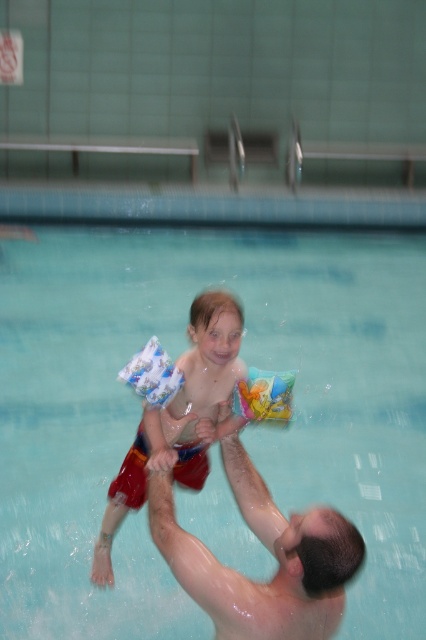
Question: Is shiny wet skin at center below white printed armbands at center?

Choices:
 (A) yes
 (B) no

Answer: (B)

Question: Is shiny wet skin at center to the right of multicolored plastic toy at upper center from the viewer's perspective?

Choices:
 (A) yes
 (B) no

Answer: (B)

Question: Which point is farther to the camera?

Choices:
 (A) white printed armbands at center
 (B) white printed floaties at center
 (C) shiny wet skin at center

Answer: (B)

Question: Can you confirm if multicolored plastic toy at upper center is bigger than white printed floaties at center?

Choices:
 (A) no
 (B) yes

Answer: (A)

Question: Among these points, which one is farthest from the camera?

Choices:
 (A) (138, 378)
 (B) (63, 296)
 (C) (195, 426)
 (D) (268, 380)

Answer: (B)

Question: Among these points, which one is nearest to the camera?

Choices:
 (A) (196, 388)
 (B) (103, 298)
 (C) (210, 570)
 (D) (284, 406)

Answer: (C)